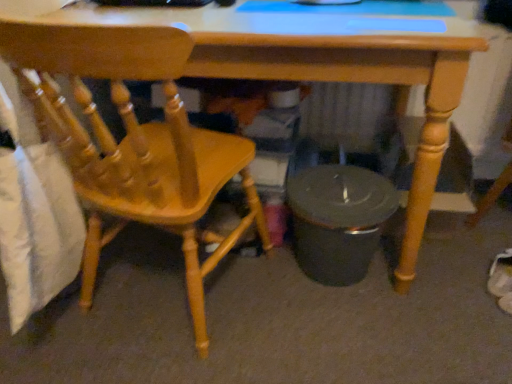
Question: Relative to matte wood chair at left, is wooden desk at center in front or behind?

Choices:
 (A) behind
 (B) front

Answer: (A)

Question: Is wooden desk at center spatially inside matte wood chair at left, or outside of it?

Choices:
 (A) outside
 (B) inside

Answer: (A)

Question: Is point (193, 74) positioned closer to the camera than point (142, 185)?

Choices:
 (A) closer
 (B) farther

Answer: (B)

Question: Is matte wood chair at left in front of or behind wooden desk at center in the image?

Choices:
 (A) front
 (B) behind

Answer: (A)

Question: Would you say matte wood chair at left is to the left or to the right of wooden desk at center in the picture?

Choices:
 (A) right
 (B) left

Answer: (B)

Question: Is matte wood chair at left inside or outside of wooden desk at center?

Choices:
 (A) outside
 (B) inside

Answer: (B)

Question: Looking at the image, does matte wood chair at left seem bigger or smaller compared to wooden desk at center?

Choices:
 (A) big
 (B) small

Answer: (B)